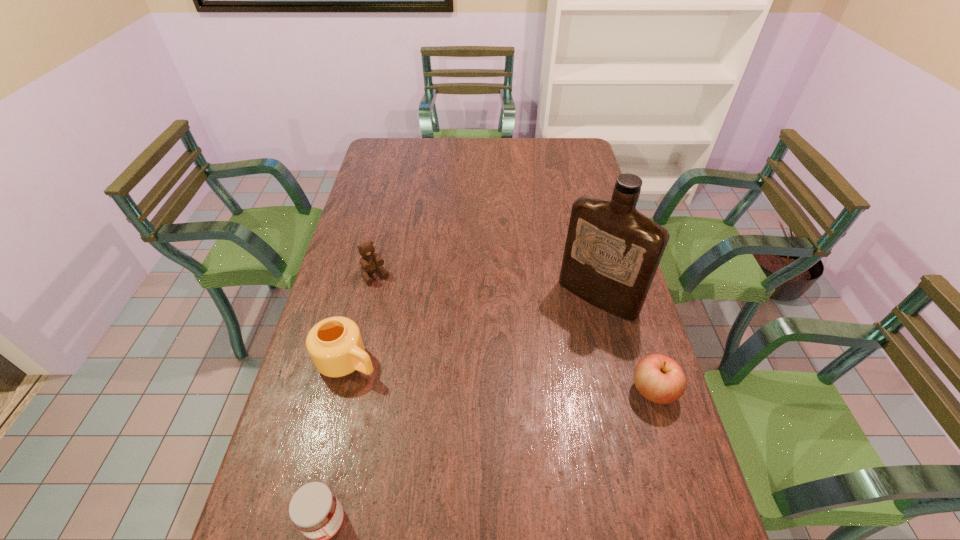
What are the coordinates of `free space located 0.330m on the handle side of the mug` in the screenshot? It's located at (480, 434).

Find the location of a particular element. Image resolution: width=960 pixels, height=540 pixels. free space located 0.110m on the face of the teddy bear is located at coordinates (396, 308).

This screenshot has height=540, width=960. Find the location of `free region located 0.140m on the face of the teddy bear`. free region located 0.140m on the face of the teddy bear is located at coordinates (399, 315).

Where is `free location located 0.080m on the face of the teddy bear`? This screenshot has height=540, width=960. free location located 0.080m on the face of the teddy bear is located at coordinates (391, 302).

At what (x,y) coordinates should I click in order to perform the action: click on mug located at the left edge. Please return your answer as a coordinate pair (x, y). Looking at the image, I should click on (335, 345).

I want to click on teddy bear located at the left edge, so click(x=370, y=261).

Identify the location of apple positioned at the right edge. Image resolution: width=960 pixels, height=540 pixels. (660, 379).

Image resolution: width=960 pixels, height=540 pixels. What are the coordinates of `liquor that is positioned at the right edge` in the screenshot? It's located at (612, 251).

You are a GUI agent. You are given a task and a screenshot of the screen. Output one action in this format:
    pyautogui.click(x=<x>, y=<y>)
    Task: Click on the vacant region at the far edge of the desktop
    This screenshot has width=960, height=540.
    Given the screenshot: What is the action you would take?
    pyautogui.click(x=430, y=159)

Find the location of `vacant space at the near edge of the desktop`. vacant space at the near edge of the desktop is located at coordinates (454, 506).